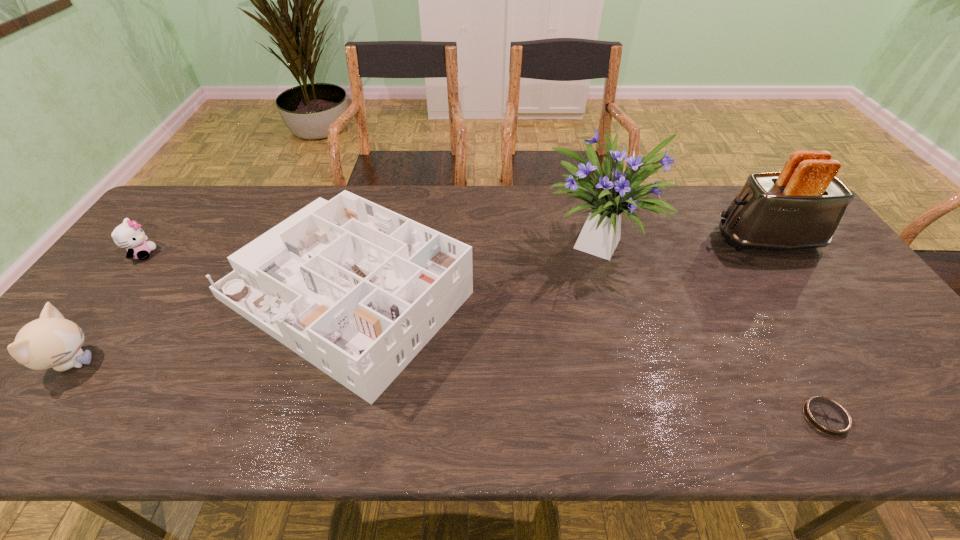
The image size is (960, 540). Identify the location of vacant space situated 0.240m on the side of the fifth shortest object with the control lever. (636, 240).

The image size is (960, 540). I want to click on vacant space located on the side of the fifth shortest object with the control lever, so click(653, 240).

This screenshot has height=540, width=960. I want to click on vacant space positioned 0.100m on the back of the dollhouse, so click(x=372, y=201).

This screenshot has height=540, width=960. In order to click on vacant space located 0.340m on the face of the nearer kitten in this screenshot , I will do `click(242, 363)`.

The height and width of the screenshot is (540, 960). I want to click on free point located on the front-facing side of the farther kitten, so click(x=192, y=254).

Locate an element on the screen. blank space located on the left of the compass is located at coordinates (668, 417).

Identify the location of flower arrangement that is at the far edge. (612, 192).

You are a GUI agent. You are given a task and a screenshot of the screen. Output one action in this format:
    pyautogui.click(x=<x>, y=<y>)
    Task: Click on the toaster positioned at the far edge
    
    Given the screenshot: What is the action you would take?
    pyautogui.click(x=800, y=207)

Where is `dollhouse located in the far edge section of the desktop`? dollhouse located in the far edge section of the desktop is located at coordinates (357, 290).

Identify the location of dollhouse situated at the near edge. The image size is (960, 540). (357, 290).